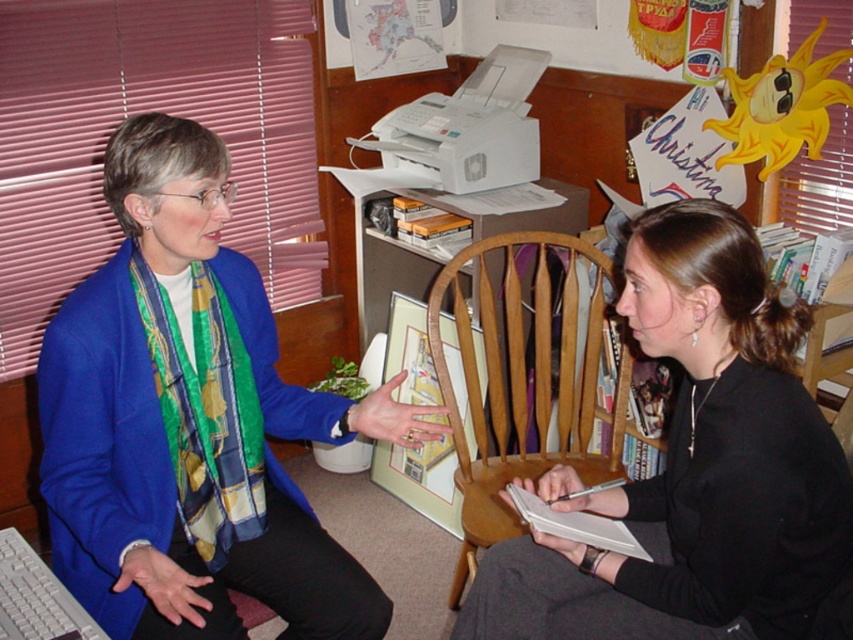
Question: Which of the following is the closest to the observer?

Choices:
 (A) (560, 186)
 (B) (271, 419)
 (C) (669, 296)

Answer: (C)

Question: Is blue silk scarf at upper left smaller than wooden chair at center?

Choices:
 (A) no
 (B) yes

Answer: (B)

Question: Which point appears farthest from the camera in this image?

Choices:
 (A) (506, 410)
 (B) (479, 220)
 (C) (805, 432)

Answer: (A)

Question: Which of the following is the farthest from the observer?

Choices:
 (A) (820, 454)
 (B) (33, 604)
 (C) (383, 316)

Answer: (C)

Question: Does black matte notebook at center come behind wooden chair at center?

Choices:
 (A) no
 (B) yes

Answer: (A)

Question: Does wooden chair at center appear on the left side of white cardboard computer desk at center?

Choices:
 (A) no
 (B) yes

Answer: (A)